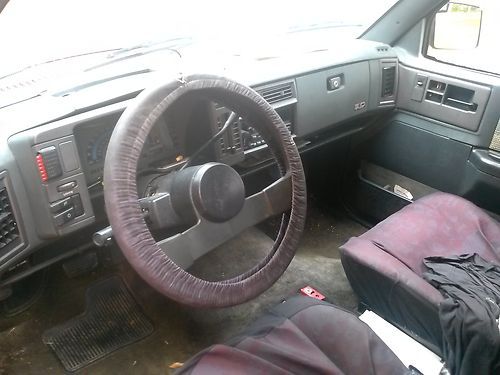
Find the location of a particular element. Image resolution: width=500 pixels, height=375 pixels. vent is located at coordinates (389, 86), (274, 94), (235, 138), (11, 231), (6, 208).